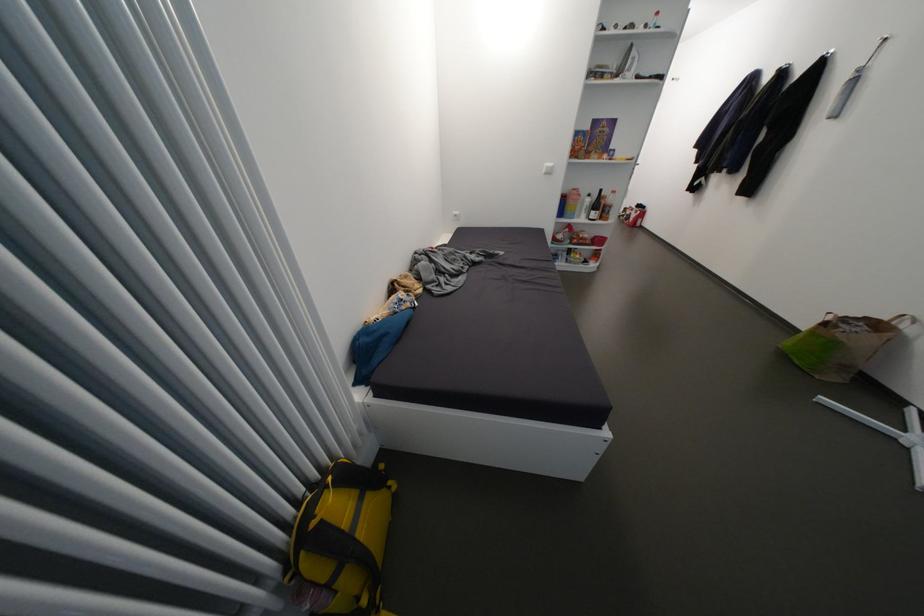
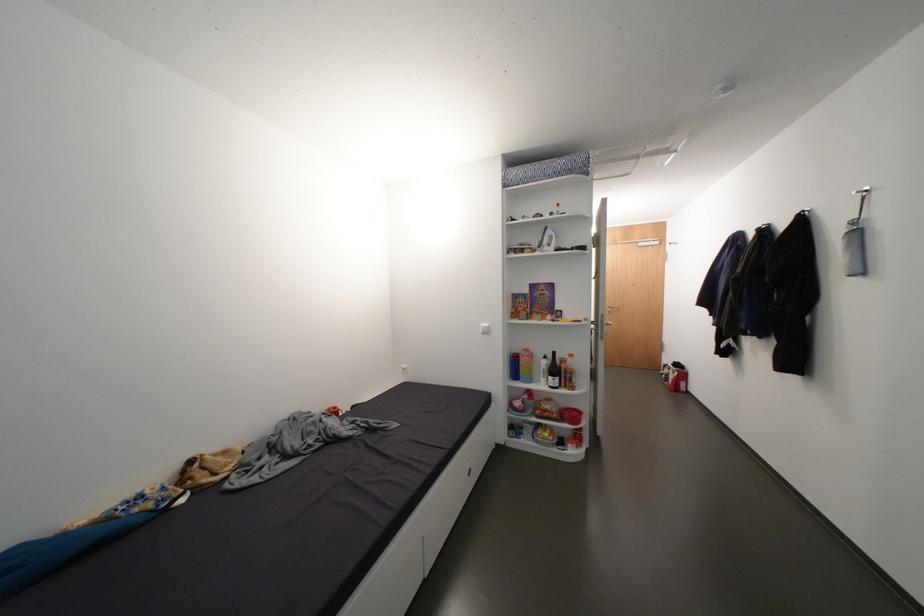
In the second image, find the point that corresponds to [636,67] in the first image.

(553, 243)